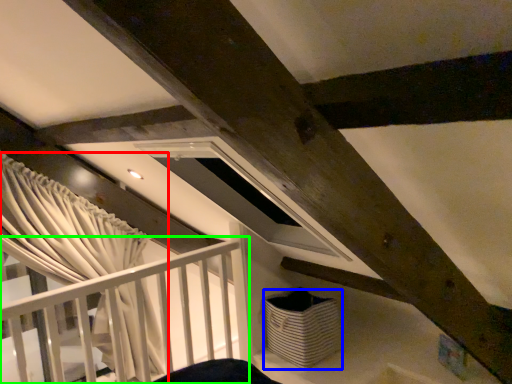
Question: Which is farther away from curtain (highlighted by a red box)? basket (highlighted by a blue box) or rail (highlighted by a green box)?

Choices:
 (A) basket
 (B) rail

Answer: (A)